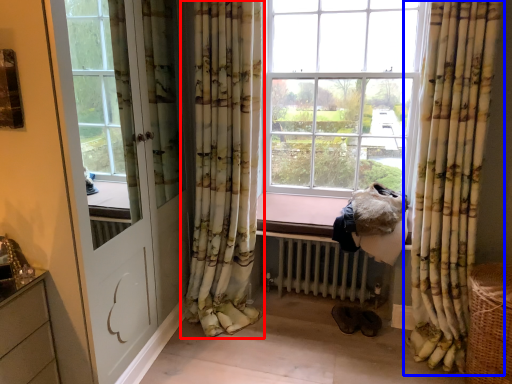
Question: Which of the following is the farthest to the observer, curtain (highlighted by a red box) or curtain (highlighted by a blue box)?

Choices:
 (A) curtain
 (B) curtain

Answer: (A)